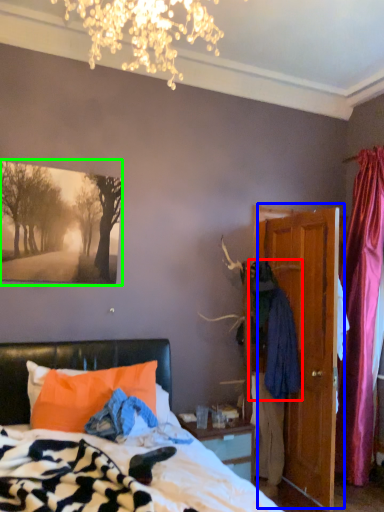
Question: Which is farther away from clothing (highlighted by a red box)? door (highlighted by a blue box) or picture frame (highlighted by a green box)?

Choices:
 (A) door
 (B) picture frame

Answer: (B)